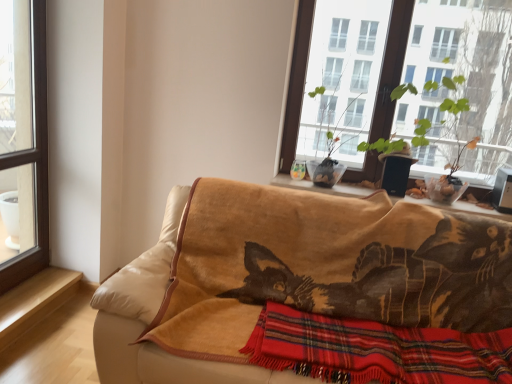
This screenshot has width=512, height=384. In order to click on transparent glass window at upper center, which appears as the second window when viewed from the left in this screenshot , I will do `click(401, 81)`.

Find the location of a particular element. The height and width of the screenshot is (384, 512). green leafy plant at upper right is located at coordinates (381, 145).

What are the coordinates of `velvet beige couch at center` in the screenshot? It's located at (151, 320).

In order to click on transparent glass window at upper center, which is the first window from right to left in this screenshot , I will do `click(401, 81)`.

Considering the sizes of objects velvet beige couch at center and green leafy plant at upper right in the image provided, who is taller, velvet beige couch at center or green leafy plant at upper right?

With more height is velvet beige couch at center.

Which of these two, velvet beige couch at center or green leafy plant at upper right, is wider?

Wider between the two is velvet beige couch at center.

Does point (147, 276) appear closer or farther from the camera than point (426, 127)?

Point (147, 276) appears to be closer to the viewer than point (426, 127).

Would you consider velvet beige couch at center to be distant from green leafy plant at upper right?

velvet beige couch at center is positioned a significant distance from green leafy plant at upper right.

Does point (426, 73) come behind point (355, 196)?

Yes, it is.

Based on the photo, looking at the image, does transparent glass window at upper center, which is the first window from right to left, seem bigger or smaller compared to wooden window sill at center, positioned as the 1th window sill in right-to-left order?

Clearly, transparent glass window at upper center, which is the first window from right to left, is larger in size than wooden window sill at center, positioned as the 1th window sill in right-to-left order.

From the image's perspective, which one is positioned higher, transparent glass window at upper center, which appears as the second window when viewed from the left, or wooden window sill at center, the 2th window sill when ordered from bottom to top?

transparent glass window at upper center, which appears as the second window when viewed from the left, appears higher in the image.

Is transparent glass window at upper center, which appears as the second window when viewed from the left, positioned with its back to wooden window sill at center, positioned as the 1th window sill in right-to-left order?

That's not correct — transparent glass window at upper center, which appears as the second window when viewed from the left, is not looking away from wooden window sill at center, positioned as the 1th window sill in right-to-left order.

Identify the location of studio couch to the left of transparent glass window at upper center, which is the first window from right to left. (151, 320).

Is transparent glass window at upper center, which is the first window from right to left, to the left of velvet beige couch at center from the viewer's perspective?

No, transparent glass window at upper center, which is the first window from right to left, is not to the left of velvet beige couch at center.

From the image's perspective, does transparent glass window at upper center, which appears as the second window when viewed from the left, appear lower than velvet beige couch at center?

No, from the image's perspective, transparent glass window at upper center, which appears as the second window when viewed from the left, is not beneath velvet beige couch at center.

Is transparent glass window at upper center, which appears as the second window when viewed from the left, directly adjacent to velvet beige couch at center?

No.

Does point (16, 295) lie behind point (332, 338)?

Yes, it is behind point (332, 338).

Is light brown wood at lower left, the 2th window sill positioned from the right, beside red plaid blanket at lower center?

No, light brown wood at lower left, the 2th window sill positioned from the right, is not next to red plaid blanket at lower center.

From a real-world perspective, does light brown wood at lower left, the 2th window sill positioned from the right, stand above red plaid blanket at lower center?

No, from a real-world perspective, light brown wood at lower left, the 2th window sill positioned from the right, is not on top of red plaid blanket at lower center.

Which object is positioned more to the left, light brown wood at lower left, positioned as the second window sill in top-to-bottom order, or red plaid blanket at lower center?

Positioned to the left is light brown wood at lower left, positioned as the second window sill in top-to-bottom order.

Considering the positions of objects transparent glass window at left, which is counted as the 2th window, starting from the right, and velvet beige couch at center in the image provided, who is more to the left, transparent glass window at left, which is counted as the 2th window, starting from the right, or velvet beige couch at center?

Positioned to the left is transparent glass window at left, which is counted as the 2th window, starting from the right.

Which of these two, transparent glass window at left, which is counted as the 2th window, starting from the right, or velvet beige couch at center, is bigger?

velvet beige couch at center.

From the picture: Can velvet beige couch at center be found inside transparent glass window at left, the first window from the left?

No, velvet beige couch at center is not a part of transparent glass window at left, the first window from the left.

Between transparent glass window at left, the first window from the left, and velvet beige couch at center, which one is positioned behind?

transparent glass window at left, the first window from the left, is further away from the camera.

Is wooden window sill at center, positioned as the first window sill in top-to-bottom order, surrounded by red plaid blanket at lower center?

Actually, wooden window sill at center, positioned as the first window sill in top-to-bottom order, is outside red plaid blanket at lower center.

Does red plaid blanket at lower center lie behind wooden window sill at center, positioned as the first window sill in top-to-bottom order?

No, it is not.

Is red plaid blanket at lower center far away from wooden window sill at center, positioned as the first window sill in top-to-bottom order?

red plaid blanket at lower center is actually quite close to wooden window sill at center, positioned as the first window sill in top-to-bottom order.

Considering the relative positions of red plaid blanket at lower center and wooden window sill at center, the 2th window sill in the left-to-right sequence, in the image provided, is red plaid blanket at lower center to the left of wooden window sill at center, the 2th window sill in the left-to-right sequence, from the viewer's perspective?

Correct, you'll find red plaid blanket at lower center to the left of wooden window sill at center, the 2th window sill in the left-to-right sequence.

From the image's perspective, which one is positioned lower, green leafy plant at upper right or light brown wood at lower left, positioned as the second window sill in top-to-bottom order?

From the image's view, light brown wood at lower left, positioned as the second window sill in top-to-bottom order, is below.

What's the angular difference between green leafy plant at upper right and light brown wood at lower left, the 2th window sill positioned from the right,'s facing directions?

The angular difference between green leafy plant at upper right and light brown wood at lower left, the 2th window sill positioned from the right, is 89.8 degrees.

From the green leafy plant at upper right, count the 2nd window sill to the left and point to it. Please provide its 2D coordinates.

[(34, 301)]

Do you think green leafy plant at upper right is within light brown wood at lower left, positioned as the second window sill in top-to-bottom order, or outside of it?

green leafy plant at upper right is located beyond the bounds of light brown wood at lower left, positioned as the second window sill in top-to-bottom order.

This screenshot has height=384, width=512. In order to click on houseplant behind the velvet beige couch at center in this screenshot , I will do `click(381, 145)`.

The image size is (512, 384). I want to click on window sill that is the 1st object located below the transparent glass window at upper center, which appears as the second window when viewed from the left (from the image's perspective), so click(x=321, y=188).

Which object lies further to the anchor point transparent glass window at upper center, which appears as the second window when viewed from the left, transparent glass window at left, which is counted as the 2th window, starting from the right, or green leafy plant at upper right?

transparent glass window at left, which is counted as the 2th window, starting from the right.

Considering their positions, is red plaid blanket at lower center positioned further to wooden window sill at center, the 2th window sill when ordered from bottom to top, than velvet beige couch at center?

The object further to wooden window sill at center, the 2th window sill when ordered from bottom to top, is velvet beige couch at center.

Considering their positions, is green leafy plant at upper right positioned closer to velvet beige couch at center than red plaid blanket at lower center?

red plaid blanket at lower center is closer to velvet beige couch at center.

When comparing their distances from green leafy plant at upper right, does light brown wood at lower left, which ranks as the first window sill in bottom-to-top order, or transparent glass window at left, the first window from the left, seem closer?

transparent glass window at left, the first window from the left, is positioned closer to the anchor green leafy plant at upper right.

Estimate the real-world distances between objects in this image. Which object is further from light brown wood at lower left, the 1th window sill in the left-to-right sequence, red plaid blanket at lower center or velvet beige couch at center?

red plaid blanket at lower center is positioned further to the anchor light brown wood at lower left, the 1th window sill in the left-to-right sequence.

Based on their spatial positions, is green leafy plant at upper right or wooden window sill at center, positioned as the 1th window sill in right-to-left order, further from transparent glass window at upper center, which is the first window from right to left?

wooden window sill at center, positioned as the 1th window sill in right-to-left order, is positioned further to the anchor transparent glass window at upper center, which is the first window from right to left.

From the picture: Considering their positions, is light brown wood at lower left, positioned as the second window sill in top-to-bottom order, positioned closer to red plaid blanket at lower center than wooden window sill at center, positioned as the first window sill in top-to-bottom order?

wooden window sill at center, positioned as the first window sill in top-to-bottom order.

In the scene shown: When comparing their distances from velvet beige couch at center, does transparent glass window at left, the first window from the left, or green leafy plant at upper right seem further?

green leafy plant at upper right.

At what (x,y) coordinates should I click in order to perform the action: click on plaid located between velvet beige couch at center and wooden window sill at center, the 2th window sill in the left-to-right sequence, in the depth direction. Please return your answer as a coordinate pair (x, y). Image resolution: width=512 pixels, height=384 pixels. Looking at the image, I should click on (376, 350).

Find the location of a particular element. studio couch situated between transparent glass window at left, the first window from the left, and transparent glass window at upper center, which is the first window from right to left, from left to right is located at coordinates (151, 320).

Where is `window sill located between transparent glass window at left, which is counted as the 2th window, starting from the right, and transparent glass window at upper center, which is the first window from right to left, in the left-right direction`? Image resolution: width=512 pixels, height=384 pixels. window sill located between transparent glass window at left, which is counted as the 2th window, starting from the right, and transparent glass window at upper center, which is the first window from right to left, in the left-right direction is located at coordinates (321, 188).

Find the location of a particular element. This screenshot has height=384, width=512. houseplant between velvet beige couch at center and wooden window sill at center, the 2th window sill in the left-to-right sequence, along the z-axis is located at coordinates (381, 145).